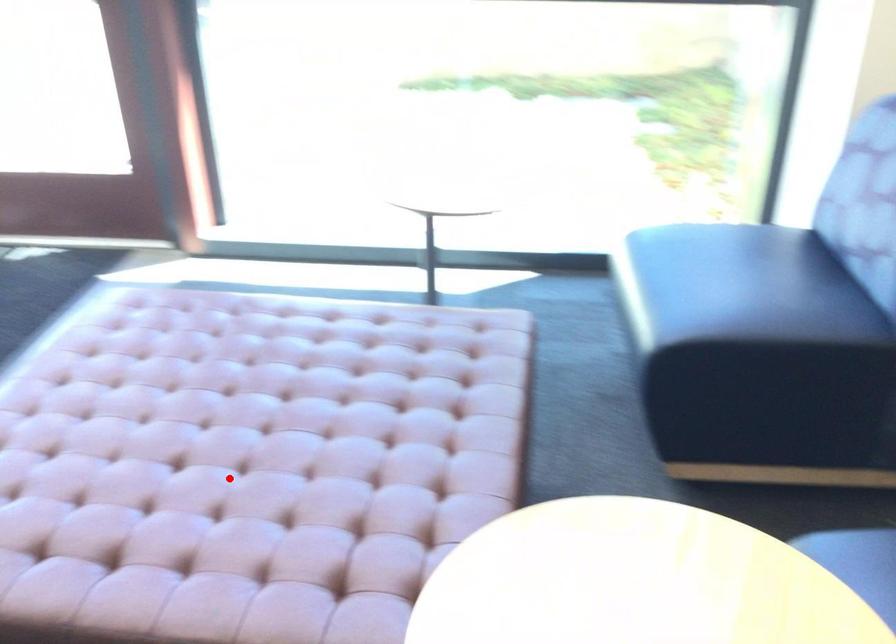
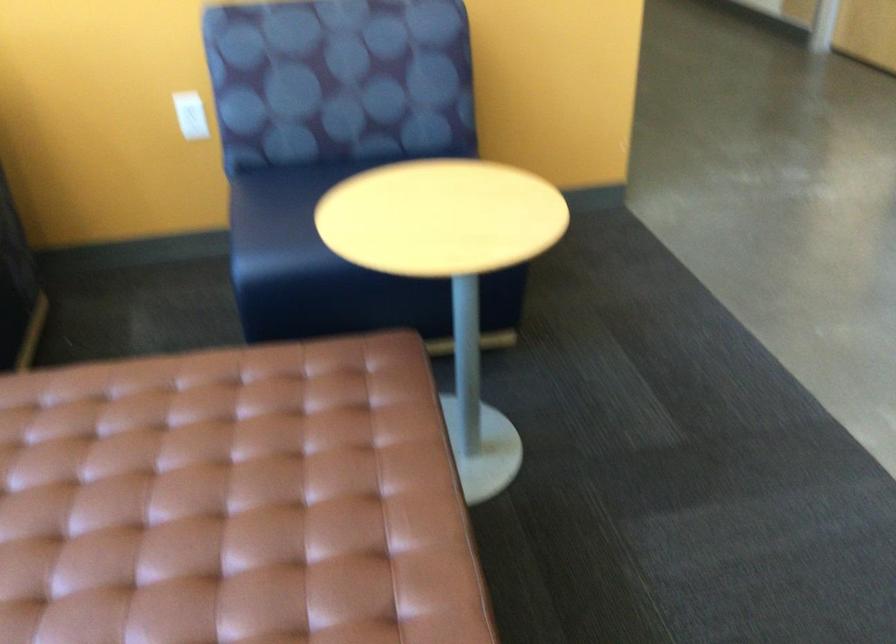
The point at the highlighted location is marked in the first image. Where is the corresponding point in the second image?

(231, 502)